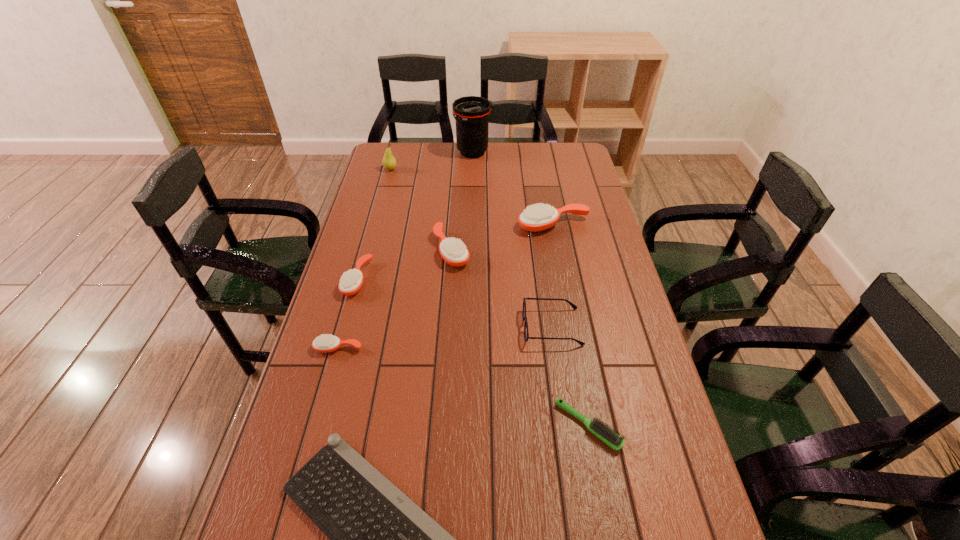
Locate an element on the screen. The height and width of the screenshot is (540, 960). the fourth farthest hairbrush is located at coordinates (325, 343).

Find the location of a particular element. The width and height of the screenshot is (960, 540). the smallest orange hairbrush is located at coordinates (325, 343).

This screenshot has width=960, height=540. I want to click on the nearest hairbrush, so click(x=597, y=427).

This screenshot has height=540, width=960. Find the location of `light hairbrush`. light hairbrush is located at coordinates (597, 427).

Locate an element on the screen. Image resolution: width=960 pixels, height=540 pixels. free point located 0.390m on the front of the telephoto lens is located at coordinates (471, 216).

Find the location of `vacant area situated 0.240m on the front of the eighth nearest object`. vacant area situated 0.240m on the front of the eighth nearest object is located at coordinates (380, 207).

Identify the location of vacant space situated on the left of the rightmost orange hairbrush. (490, 225).

Find the location of `free space located 0.290m on the back of the third hairbrush from left to right`. free space located 0.290m on the back of the third hairbrush from left to right is located at coordinates (456, 185).

What are the coordinates of `vacant area situated on the front-facing side of the spectacles` in the screenshot? It's located at (465, 327).

The image size is (960, 540). I want to click on vacant space located 0.180m on the front-facing side of the spectacles, so click(461, 327).